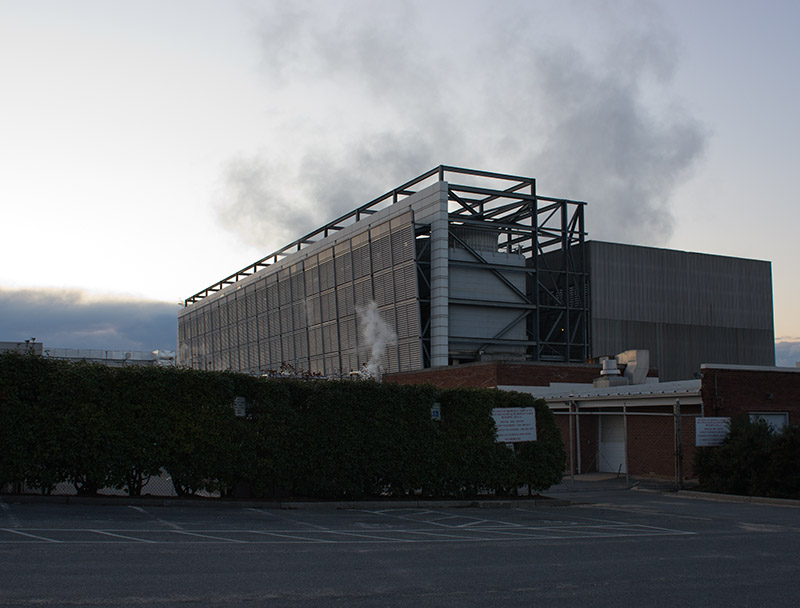
Image resolution: width=800 pixels, height=608 pixels. Identify the location of door. (614, 439).